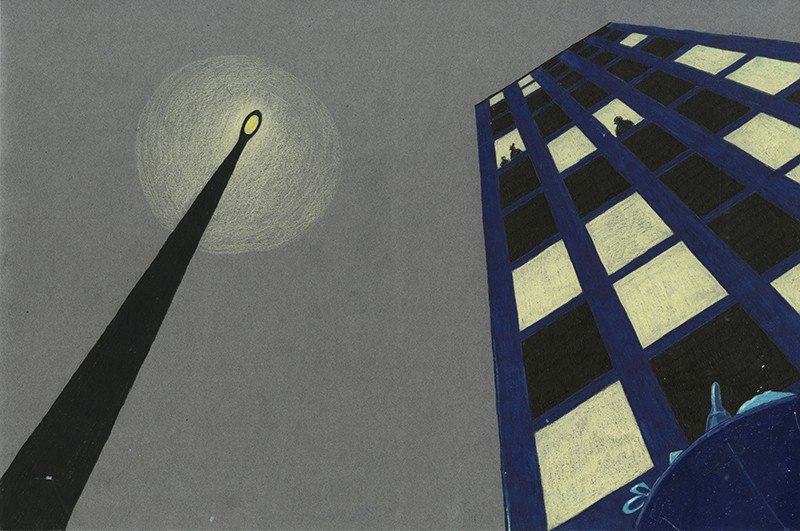
Find the location of `blue garbage can`. blue garbage can is located at coordinates (724, 491).